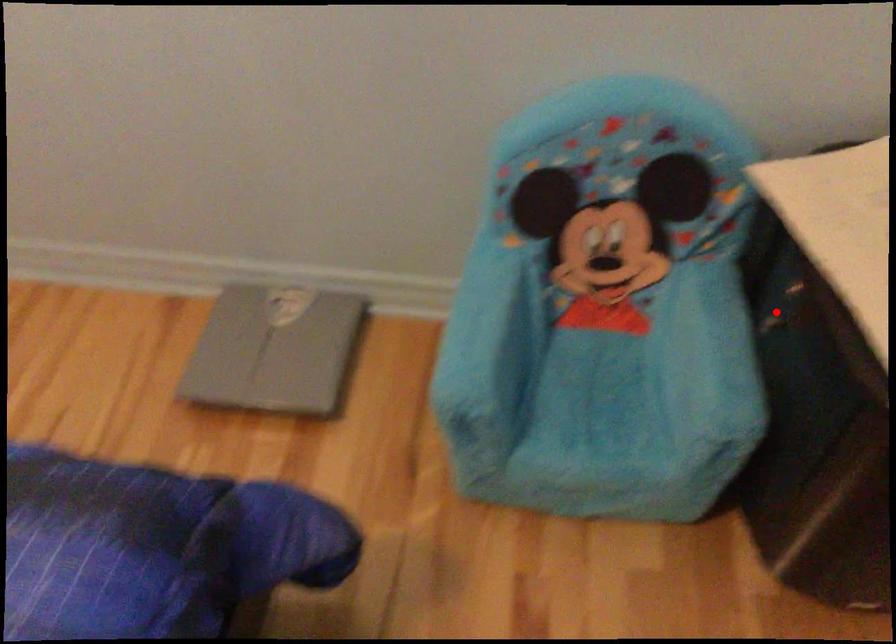
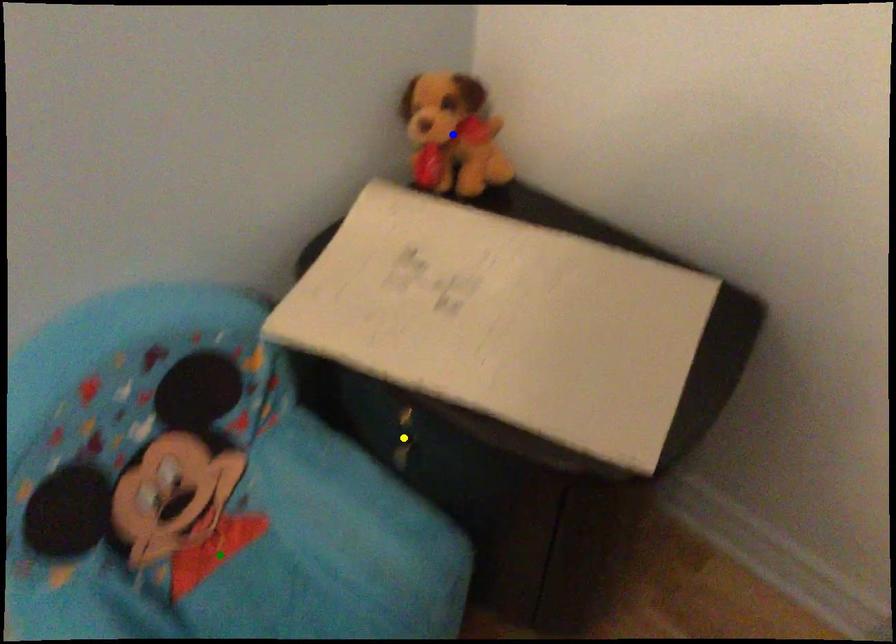
Question: I am providing you with two images of the same scene from different viewpoints. A red point is marked on the first image. You are given multiple points on the second image. Can you choose the point in image 2 that corresponds to the point in image 1?

Choices:
 (A) blue point
 (B) yellow point
 (C) green point

Answer: (B)